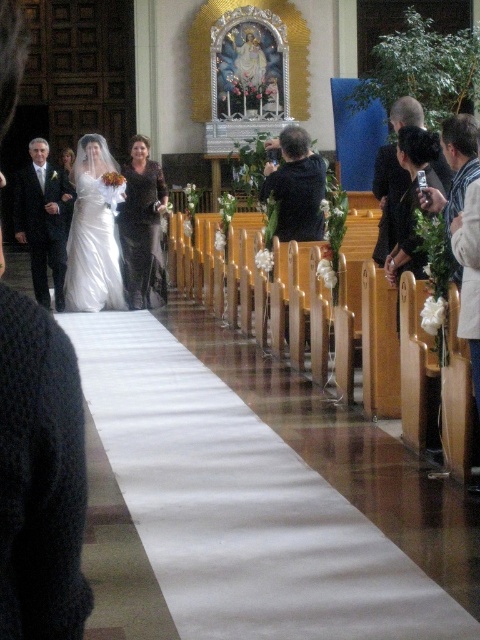
Question: Is white fabric at center bigger than black fabric at right?

Choices:
 (A) no
 (B) yes

Answer: (B)

Question: Does white fabric at center have a larger size compared to black lace dress at center?

Choices:
 (A) no
 (B) yes

Answer: (B)

Question: Which of these objects is positioned closest to the white fabric at center?

Choices:
 (A) matte black suit at left
 (B) black matte jacket at center
 (C) black lace dress at center

Answer: (B)

Question: Which object is positioned farthest from the dark gray suit at left?

Choices:
 (A) white satin dress at center
 (B) black fabric at right

Answer: (B)

Question: Can you confirm if matte black suit at left is positioned to the right of black matte jacket at center?

Choices:
 (A) no
 (B) yes

Answer: (A)

Question: Among these objects, which one is farthest from the camera?

Choices:
 (A) white satin dress at center
 (B) black fabric at right

Answer: (A)